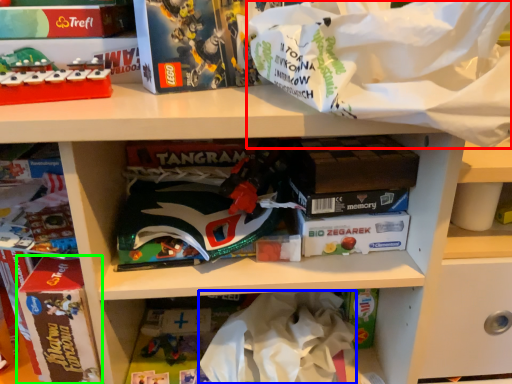
Question: Which is nearer to the material (highlighted by a red box)? clothing (highlighted by a blue box) or paperback book (highlighted by a green box).

Choices:
 (A) clothing
 (B) paperback book

Answer: (A)